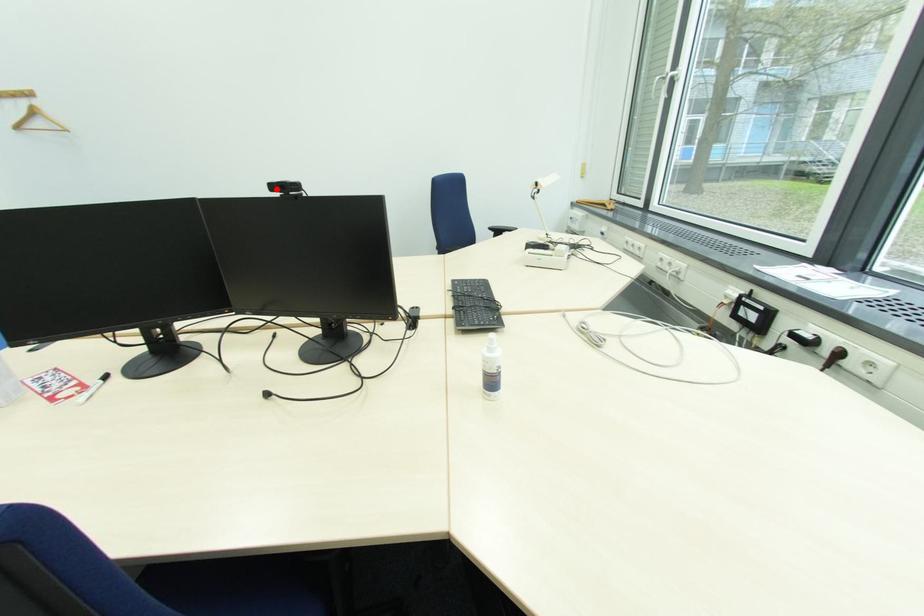
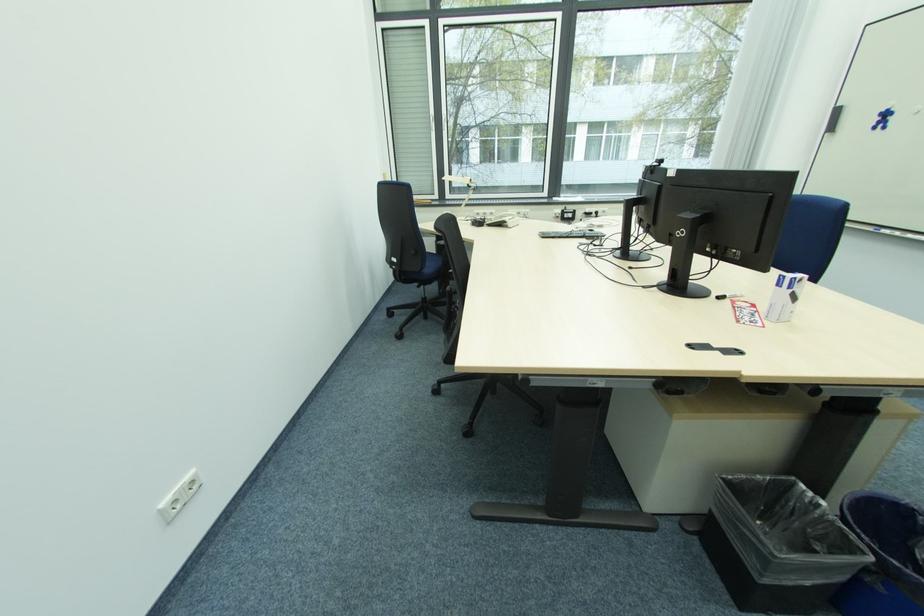
Question: I am providing you with two images of the same scene from different viewpoints. A red point is marked on the first image. At the location where the point appears in image 1, is it still visible in image 2?

Choices:
 (A) Yes
 (B) No

Answer: (B)